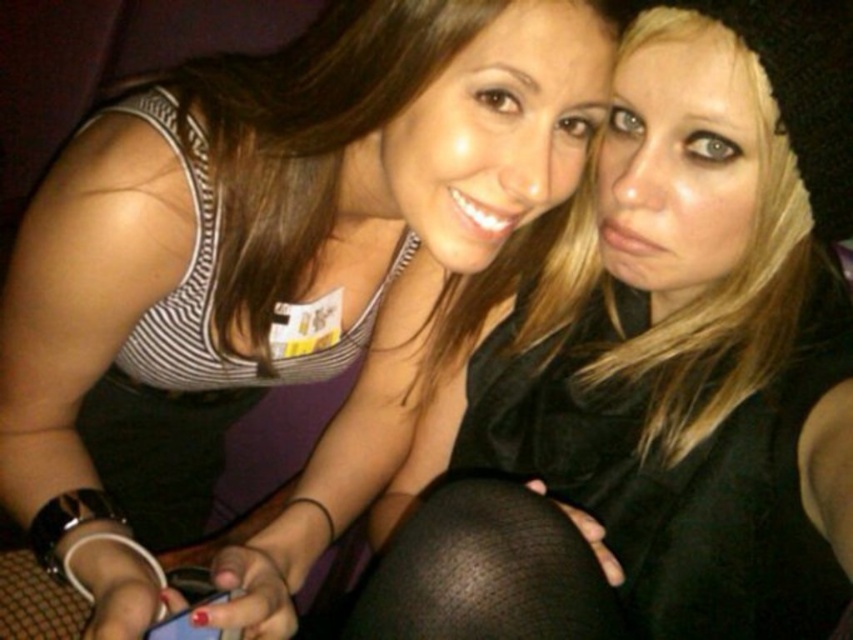
Who is positioned more to the left, matte black leggings at lower right or black mesh tights at lower center?

matte black leggings at lower right is more to the left.

Find the location of `matte black leggings at lower right`. matte black leggings at lower right is located at coordinates (283, 262).

The image size is (853, 640). I want to click on black mesh tights at lower center, so click(x=485, y=570).

Where is `black mesh tights at lower center`? This screenshot has height=640, width=853. black mesh tights at lower center is located at coordinates (485, 570).

From the picture: Who is positioned more to the right, matte black tank top at upper left or matte blue phone at lower center?

matte black tank top at upper left

Based on the photo, who is more distant from viewer, (544, 627) or (193, 632)?

The point (193, 632) is more distant.

Which is in front, point (715, 580) or point (164, 628)?

Point (715, 580) is more forward.

Locate an element on the screen. The height and width of the screenshot is (640, 853). matte black tank top at upper left is located at coordinates (657, 385).